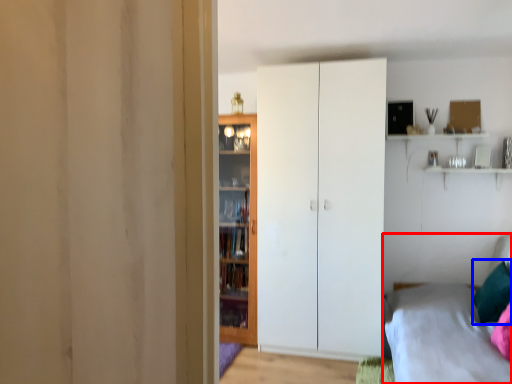
Question: Which point is further to the camera, bed (highlighted by a red box) or pillow (highlighted by a blue box)?

Choices:
 (A) bed
 (B) pillow

Answer: (B)